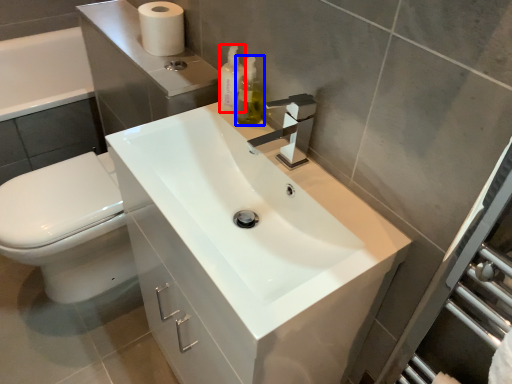
Question: Which of the following is the closest to the observer, soap dispenser (highlighted by a red box) or soap dispenser (highlighted by a blue box)?

Choices:
 (A) soap dispenser
 (B) soap dispenser

Answer: (B)